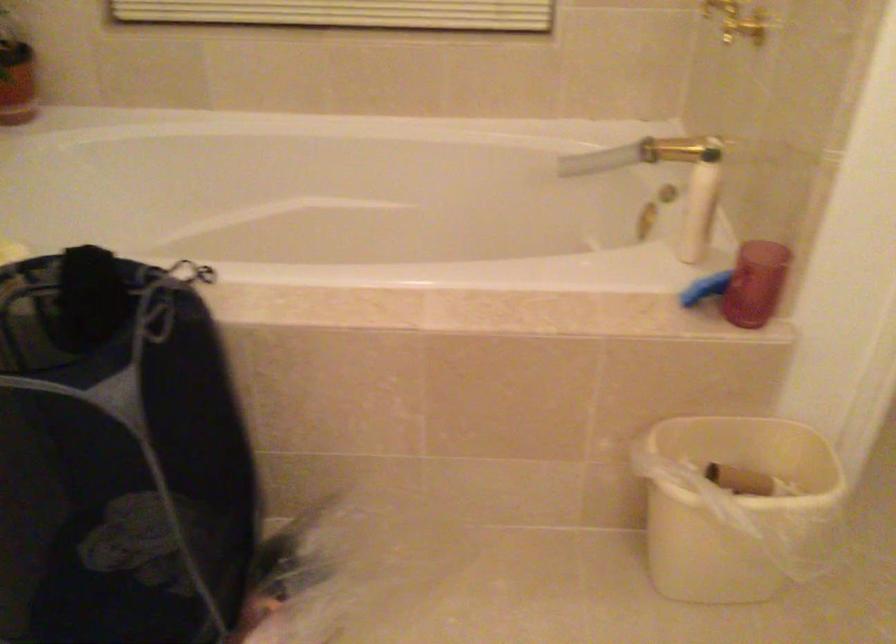
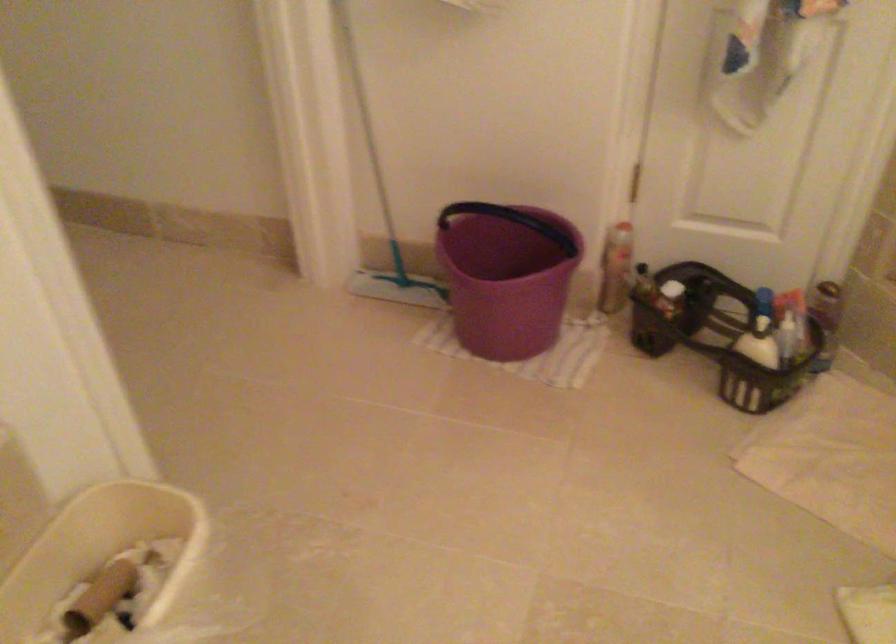
The first image is from the beginning of the video and the second image is from the end. How did the camera likely rotate when shooting the video?

The camera's rotation is toward right-down.